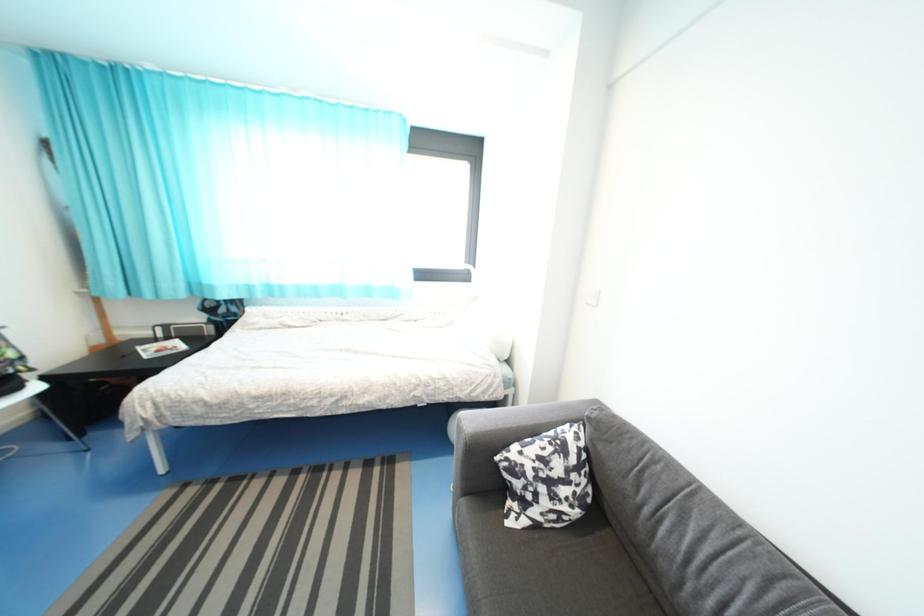
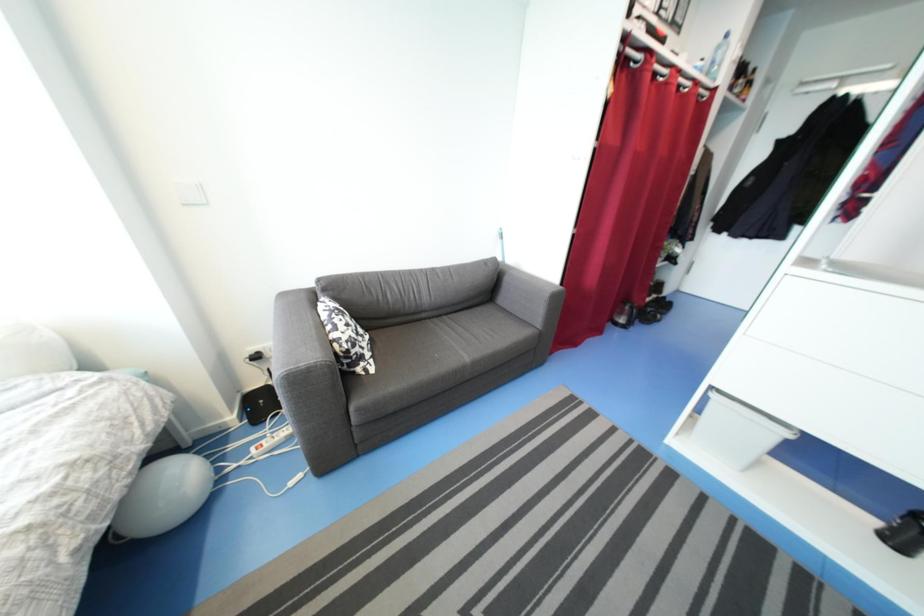
The first image is from the beginning of the video and the second image is from the end. How did the camera likely rotate when shooting the video?

The camera rotated toward right-down.